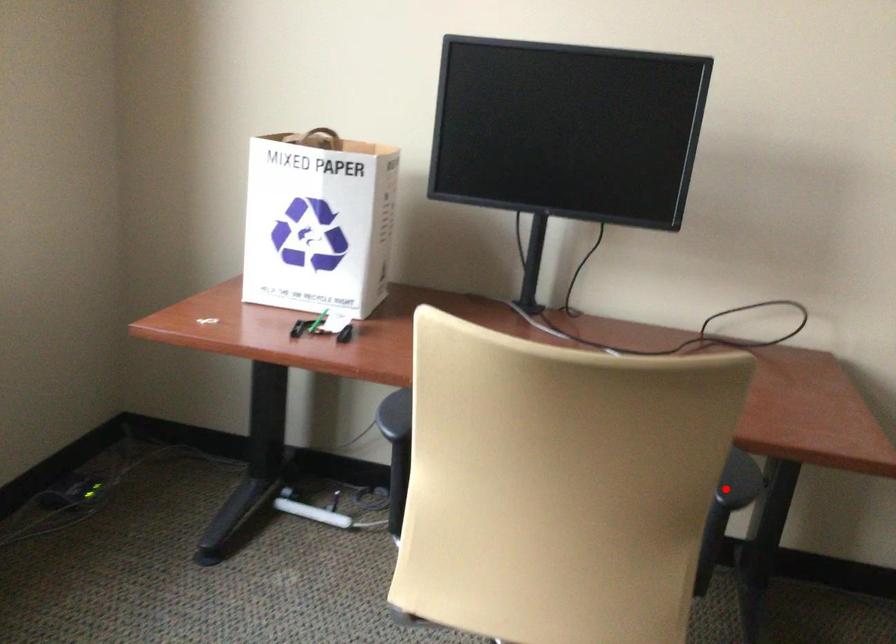
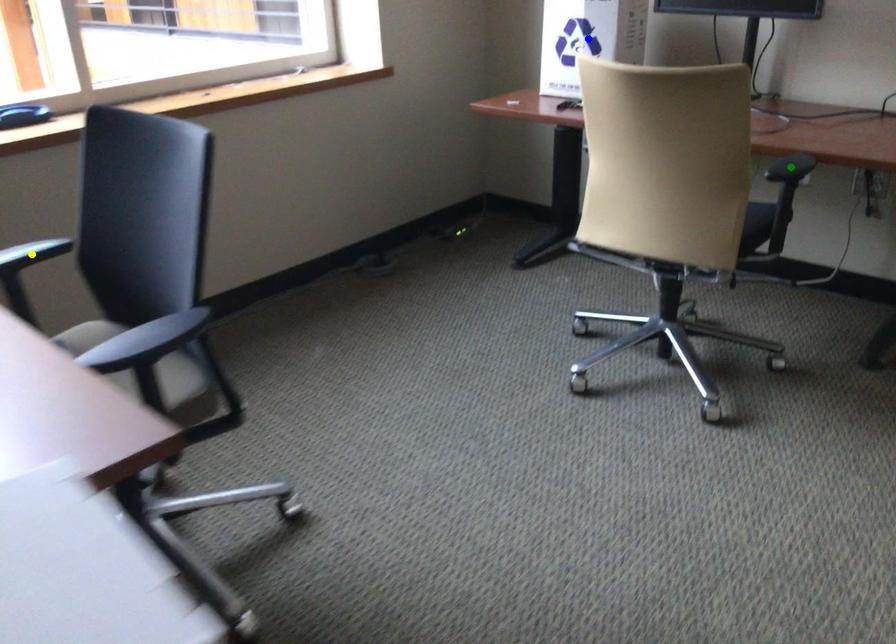
Question: I am providing you with two images of the same scene from different viewpoints. A red point is marked on the first image. You are given multiple points on the second image. Which point in image 2 represents the same 3d spot as the red point in image 1?

Choices:
 (A) green point
 (B) yellow point
 (C) blue point

Answer: (A)